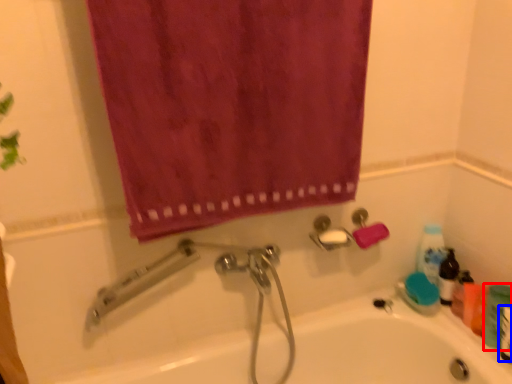
Question: Among these objects, which one is nearest to the camera, toiletry (highlighted by a red box) or mouthwash (highlighted by a blue box)?

Choices:
 (A) toiletry
 (B) mouthwash

Answer: (B)